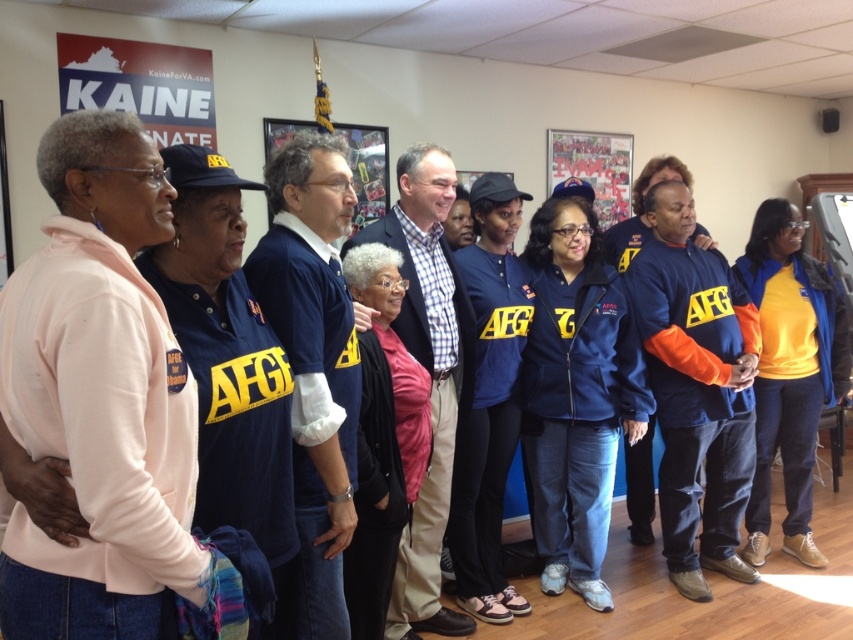
Question: Does pink fleece jacket at left appear under orange fleece jacket at center?

Choices:
 (A) yes
 (B) no

Answer: (B)

Question: Does pink fleece jacket at left have a lesser width compared to orange fleece jacket at center?

Choices:
 (A) no
 (B) yes

Answer: (B)

Question: Which point is closer to the camera?

Choices:
 (A) (165, 316)
 (B) (753, 513)

Answer: (A)

Question: Which object is closer to the camera taking this photo?

Choices:
 (A) pink fleece jacket at left
 (B) orange fleece jacket at center

Answer: (A)

Question: Can you confirm if pink fleece jacket at left is positioned above orange fleece jacket at center?

Choices:
 (A) yes
 (B) no

Answer: (A)